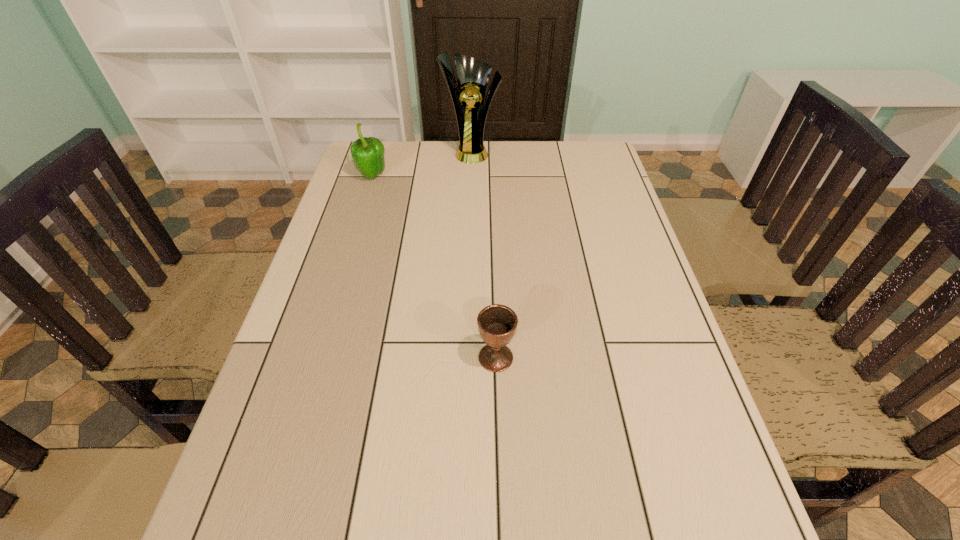
Where is `award`? This screenshot has width=960, height=540. award is located at coordinates (473, 75).

This screenshot has width=960, height=540. Find the location of `the tallest object`. the tallest object is located at coordinates (473, 75).

Locate an element on the screen. The width and height of the screenshot is (960, 540). bell pepper is located at coordinates (367, 153).

I want to click on the second nearest object, so click(x=367, y=153).

At what (x,y) coordinates should I click in order to perform the action: click on chalice. Please return your answer as a coordinate pair (x, y). Looking at the image, I should click on (497, 324).

Identify the location of the shortest object. (497, 324).

You are a GUI agent. You are given a task and a screenshot of the screen. Output one action in this format:
    pyautogui.click(x=<x>, y=<y>)
    Task: Click on the vacant space located at the front of the tallest object, where the globe is visible
    Image resolution: width=960 pixels, height=540 pixels.
    Given the screenshot: What is the action you would take?
    pyautogui.click(x=469, y=219)

The height and width of the screenshot is (540, 960). I want to click on vacant region located on the right of the leftmost object, so click(438, 177).

The image size is (960, 540). I want to click on free space located 0.080m on the back of the nearest object, so click(x=494, y=314).

Identify the location of award located in the far edge section of the desktop. (473, 75).